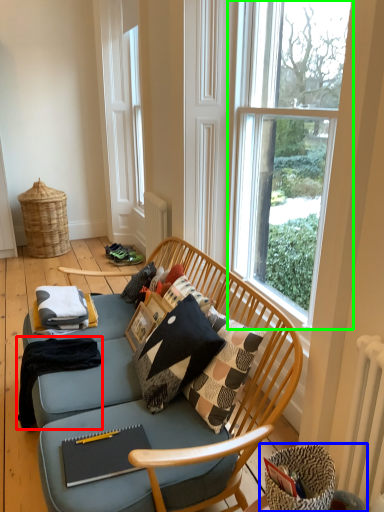
Question: Which is nearer to the blanket (highlighted by a red box)? swivel chair (highlighted by a blue box) or window (highlighted by a green box).

Choices:
 (A) swivel chair
 (B) window

Answer: (A)